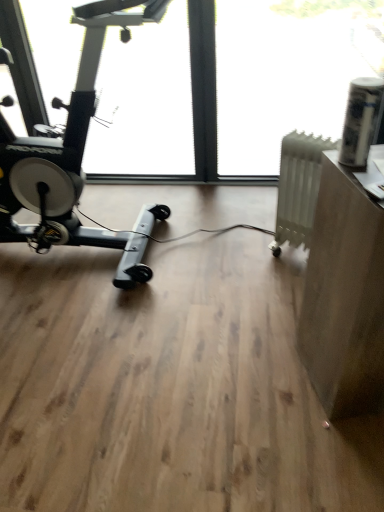
I want to click on vacant space to the left of white matte radiator at right, so click(x=244, y=261).